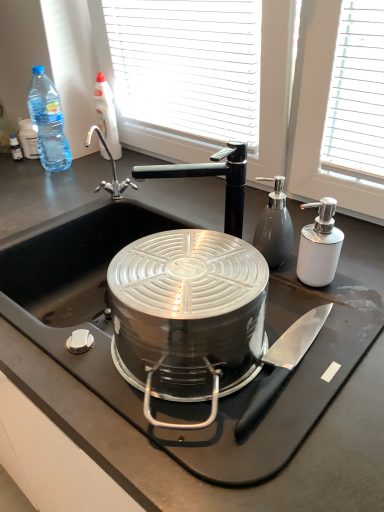
Find the location of a particular element. spots to the right of blue plastic bottle at upper left, acting as the third bottle starting from the right is located at coordinates (99, 169).